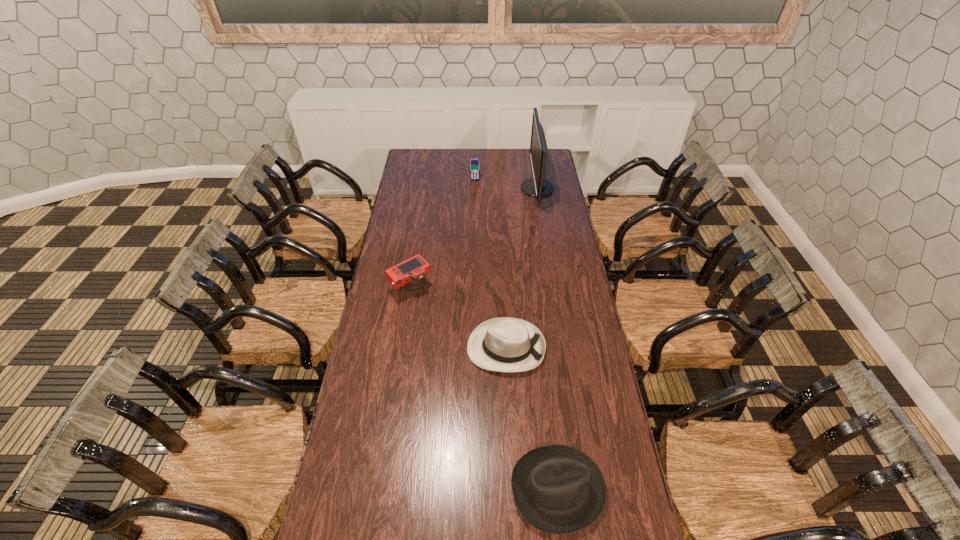
Identify the location of the tallest object. point(538,186).

Image resolution: width=960 pixels, height=540 pixels. Identify the location of cellular telephone. (474, 162).

Find the location of a particular element. This screenshot has width=960, height=540. the leftmost object is located at coordinates (410, 273).

In order to click on the third farthest object in this screenshot , I will do `click(410, 273)`.

Image resolution: width=960 pixels, height=540 pixels. I want to click on the nearest object, so click(x=557, y=489).

Locate an element on the screen. The width and height of the screenshot is (960, 540). the second nearest object is located at coordinates (504, 344).

The height and width of the screenshot is (540, 960). Find the location of `vacant space situated on the screen side of the monitor`. vacant space situated on the screen side of the monitor is located at coordinates (493, 188).

Where is `vacant region located 0.200m on the screen side of the monitor`? The width and height of the screenshot is (960, 540). vacant region located 0.200m on the screen side of the monitor is located at coordinates (484, 188).

Identify the location of vacant region located 0.320m on the screen side of the monitor. This screenshot has width=960, height=540. (463, 188).

Identify the location of vacant area situated 0.350m on the front-facing side of the cellular telephone. (474, 219).